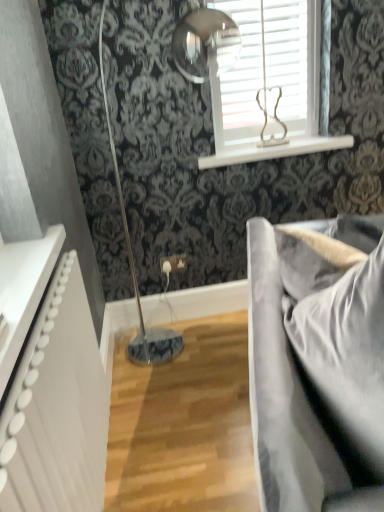
Question: From a real-world perspective, is white textured radiator at left physically above satin grey fabric couch at right?

Choices:
 (A) no
 (B) yes

Answer: (B)

Question: Is white textured radiator at left bigger than satin grey fabric couch at right?

Choices:
 (A) no
 (B) yes

Answer: (A)

Question: Does white textured radiator at left lie in front of satin grey fabric couch at right?

Choices:
 (A) no
 (B) yes

Answer: (A)

Question: Is white textured radiator at left looking in the opposite direction of satin grey fabric couch at right?

Choices:
 (A) yes
 (B) no

Answer: (B)

Question: Are white textured radiator at left and satin grey fabric couch at right beside each other?

Choices:
 (A) yes
 (B) no

Answer: (B)

Question: Considering the relative positions of white textured radiator at left and satin grey fabric couch at right in the image provided, is white textured radiator at left to the left of satin grey fabric couch at right from the viewer's perspective?

Choices:
 (A) no
 (B) yes

Answer: (B)

Question: From a real-world perspective, is satin grey fabric couch at right on white wooden blinds at upper center?

Choices:
 (A) no
 (B) yes

Answer: (A)

Question: Could you tell me if satin grey fabric couch at right is facing white wooden blinds at upper center?

Choices:
 (A) yes
 (B) no

Answer: (B)

Question: From the image's perspective, is satin grey fabric couch at right on top of white wooden blinds at upper center?

Choices:
 (A) no
 (B) yes

Answer: (A)

Question: Can white wooden blinds at upper center be found inside satin grey fabric couch at right?

Choices:
 (A) yes
 (B) no

Answer: (B)

Question: Considering the relative sizes of satin grey fabric couch at right and white wooden blinds at upper center in the image provided, is satin grey fabric couch at right taller than white wooden blinds at upper center?

Choices:
 (A) yes
 (B) no

Answer: (A)

Question: Is satin grey fabric couch at right closer to the viewer compared to white wooden blinds at upper center?

Choices:
 (A) yes
 (B) no

Answer: (A)

Question: Could satin grey fabric couch at right be considered to be inside white glossy window sill at upper center?

Choices:
 (A) yes
 (B) no

Answer: (B)